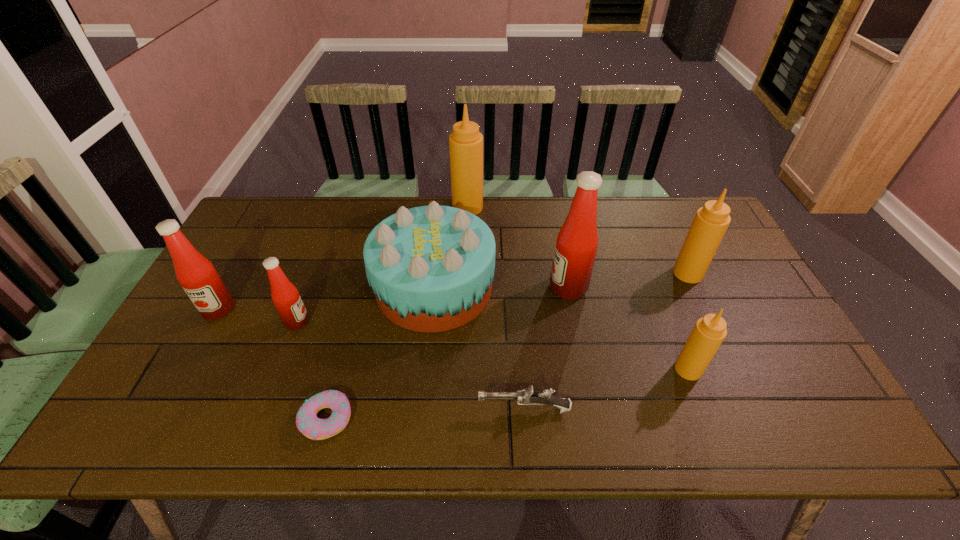
At what (x,y) coordinates should I click in order to perform the action: click on vacant space in between the gun and the leftmost object. Please return your answer as a coordinate pair (x, y). The image size is (960, 540). Looking at the image, I should click on (372, 360).

Image resolution: width=960 pixels, height=540 pixels. In order to click on empty space that is in between the cake and the gun in this screenshot , I will do `click(479, 348)`.

Find the location of a particular element. This screenshot has width=960, height=540. free point between the farthest tan condiment and the leftmost object is located at coordinates (343, 259).

Identify the location of free space between the third condiment from left to right and the third condiment from right to left. (517, 248).

The width and height of the screenshot is (960, 540). I want to click on vacant point located between the fifth condiment from right to left and the gun, so click(x=411, y=366).

Identify the location of empty space between the gun and the rightmost red condiment. The width and height of the screenshot is (960, 540). (546, 348).

I want to click on vacant space in between the smallest red condiment and the leftmost red condiment, so [x=257, y=316].

Identify the location of free space between the biggest red condiment and the rightmost tan condiment. (628, 281).

Locate which object ranks in proximity to the doughnut. Please provide its 2D coordinates. Your answer should be formatted as a tuple, i.e. [(x, y)], where the tuple contains the x and y coordinates of a point satisfying the conditions above.

[(431, 268)]

I want to click on the seventh closest object to the cake, so click(x=709, y=331).